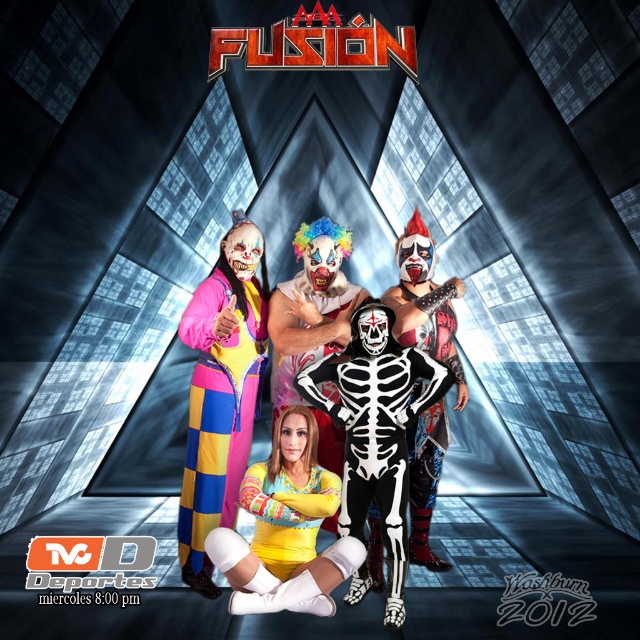
Can you confirm if black and white skeleton suit at center is positioned to the left of white skeleton costume at center?

Correct, you'll find black and white skeleton suit at center to the left of white skeleton costume at center.

Between black and white skeleton suit at center and white skeleton costume at center, which one has more height?

Standing taller between the two is white skeleton costume at center.

Between point (369, 458) and point (410, 531), which one is positioned in front?

Point (369, 458) is more forward.

This screenshot has height=640, width=640. I want to click on black and white skeleton suit at center, so click(x=376, y=429).

Which of these two, matte black skeleton suit at center or white skeleton costume at center, stands shorter?

With less height is matte black skeleton suit at center.

I want to click on matte black skeleton suit at center, so click(x=332, y=472).

Between point (240, 310) and point (348, 381), which one is positioned behind?

Positioned behind is point (240, 310).

Is matte black skeleton suit at center to the right of black and white skeleton suit at center from the viewer's perspective?

Incorrect, matte black skeleton suit at center is not on the right side of black and white skeleton suit at center.

Image resolution: width=640 pixels, height=640 pixels. What are the coordinates of `matte black skeleton suit at center` in the screenshot? It's located at (332, 472).